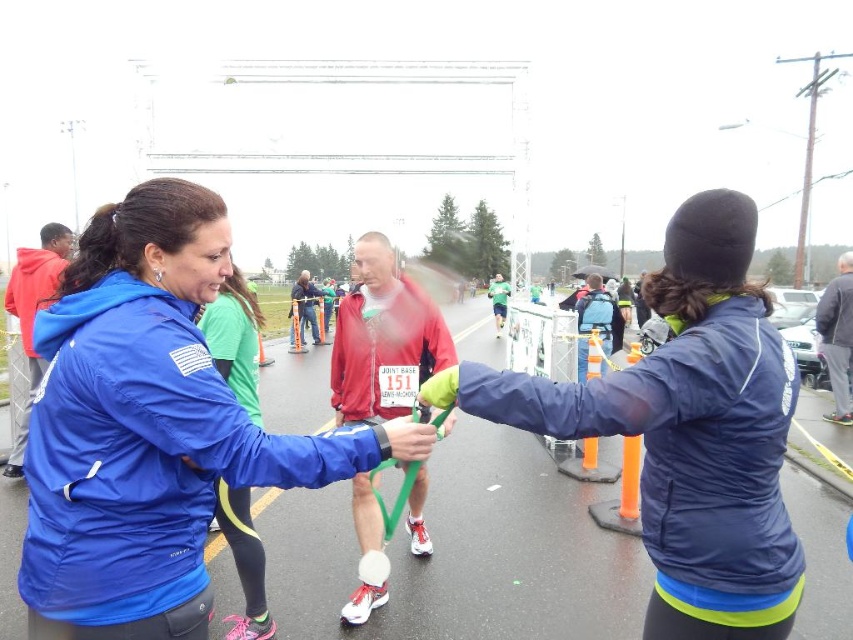
You are a photographer positioned at point A, which is at coordinates (x=149, y=428). You need to capture a photo of the blue matte jacket at center without any obstructions. Is there any object between your current position and the blue matte jacket at center that might block your view?

The blue matte jacket at center is located at point (x=149, y=428), which is exactly where you are positioned. Therefore, you are already at the same location as the blue matte jacket at center, so there are no obstructions between you and the jacket.

You are a photographer positioned at the finish line of a marathon. You need to capture a photo that includes both the blue matte jacket at center and the navy blue jacket at center. Which jacket should you adjust your camera focus to ensure the closer one is in focus?

The blue matte jacket at center is closer to the photographer than the navy blue jacket at center, so you should focus on the blue matte jacket at center to ensure the closer one is in focus.

In the scene shown: You are a photographer at the marathon finish line. You want to take a photo of the blue matte jacket at center and the navy blue jacket at center. Which jacket is covering part of the other one in the photo?

The blue matte jacket at center is positioned over the navy blue jacket at center, so it will cover part of the navy blue jacket at center in the photo.